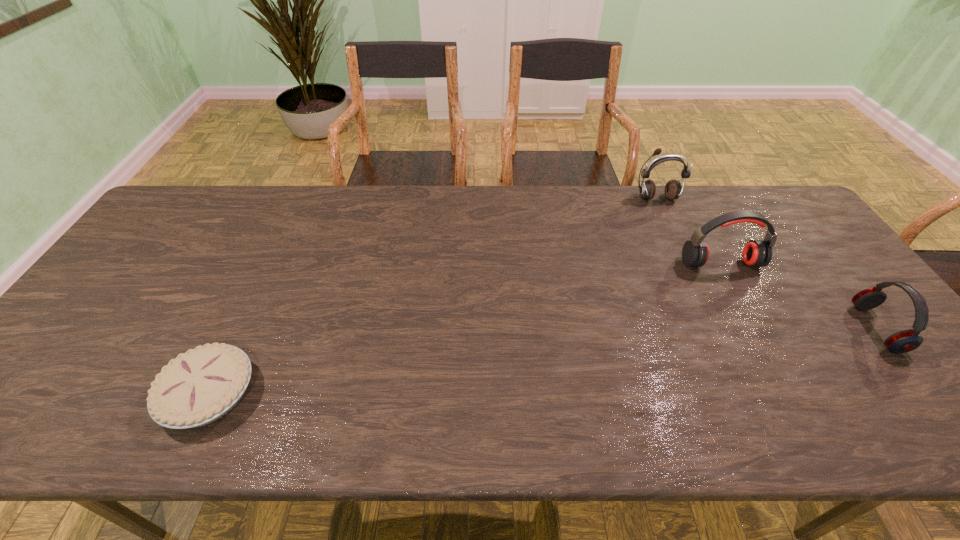
Choose which earphone is the nearest neighbor to the pie. Please provide its 2D coordinates. Your answer should be formatted as a tuple, i.e. [(x, y)], where the tuple contains the x and y coordinates of a point satisfying the conditions above.

[(757, 253)]

Identify which earphone is the second nearest to the third tallest object. Please provide its 2D coordinates. Your answer should be formatted as a tuple, i.e. [(x, y)], where the tuple contains the x and y coordinates of a point satisfying the conditions above.

[(673, 189)]